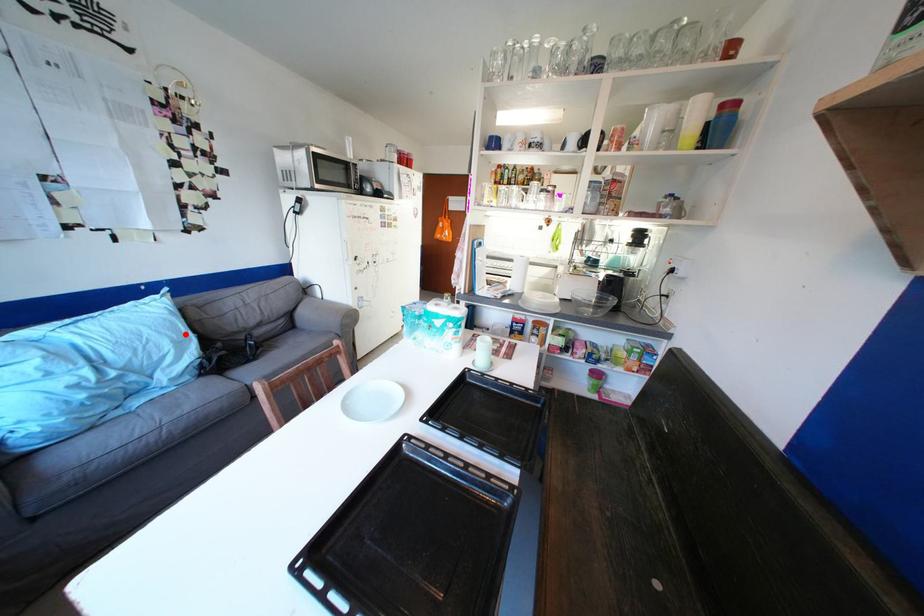
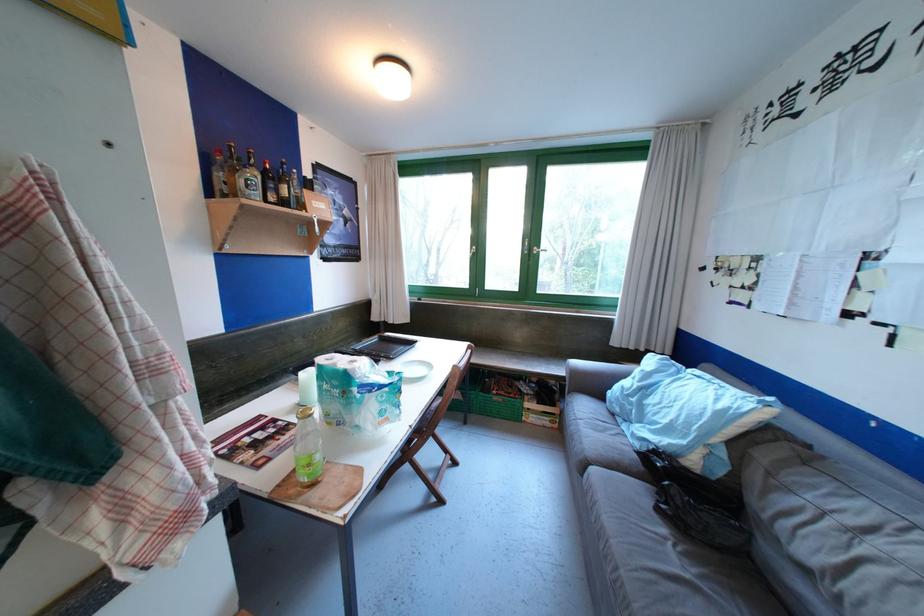
In the second image, find the point that corresponds to the highlighted location in the first image.

(697, 426)